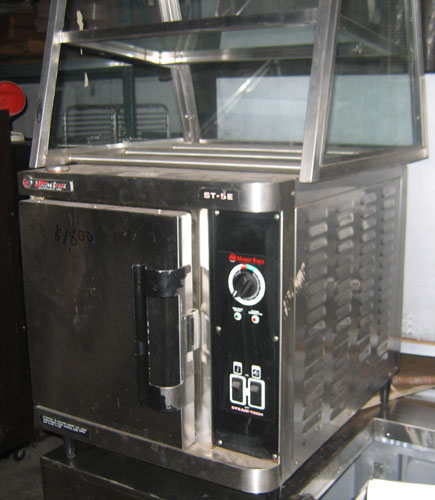
Image resolution: width=435 pixels, height=500 pixels. What are the coordinates of `front left equipment stand or leg` in the screenshot? It's located at (384, 392), (63, 447), (273, 495).